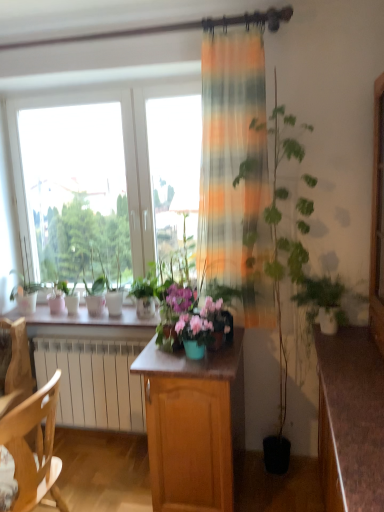
The height and width of the screenshot is (512, 384). I want to click on free space that is to the left of matte plastic flower box at center, so click(160, 360).